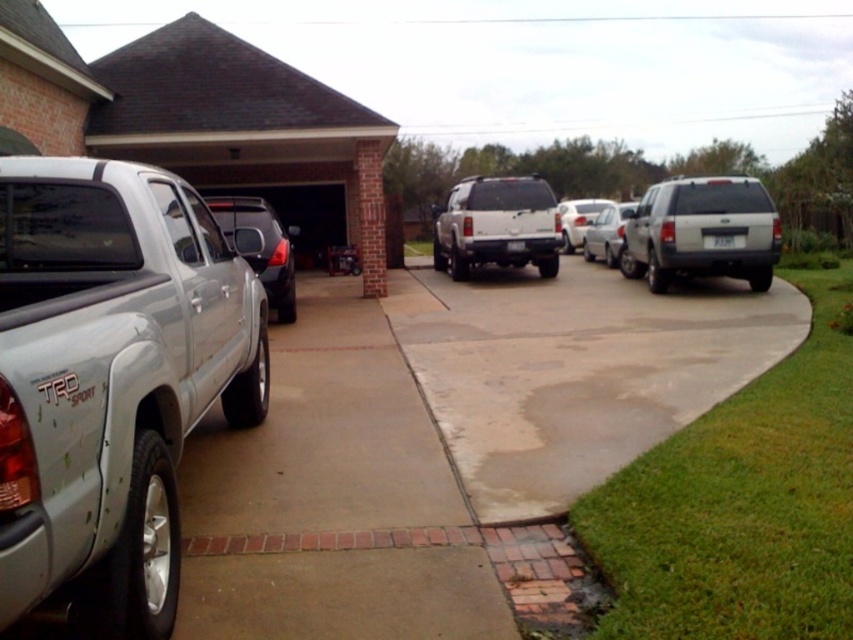
You are standing at the point marked by coordinates (575, 369) in the driveway scene. What material are you standing on?

The point at coordinates (575, 369) is on concrete, so you are standing on concrete.

You are a delivery person trying to park your van, which is 2 meters wide, in the driveway. The gray concrete pavement at lower left and the white glossy sedan at center are in your path. Can you fit your van between them?

The gray concrete pavement at lower left is thinner than the white glossy sedan at center. Since the van is 2 meters wide, you need to check the available space between them. However, the description only states that the pavement is thinner than the sedan, but doesn not provide exact measurements. Without knowing the exact width of the pavement or the sedan, it is impossible to determine if the van can fit between them.